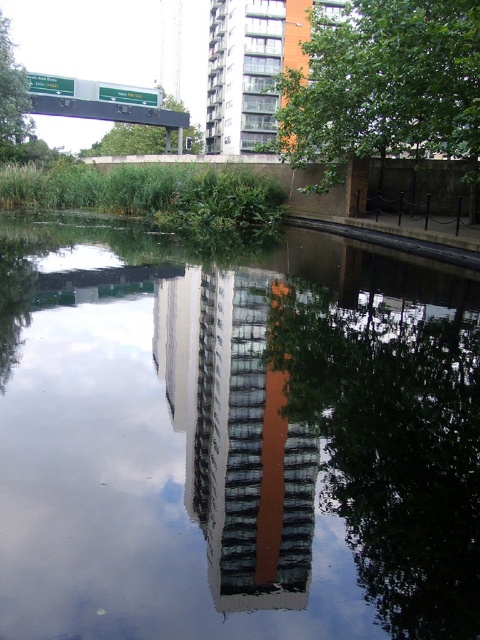
Question: Which is nearer to the green leafy tree at upper center?

Choices:
 (A) green leafy tree at upper left
 (B) reflective glass building at center

Answer: (A)

Question: Where is transparent glass water at center located in relation to green leafy tree at upper center in the image?

Choices:
 (A) below
 (B) above

Answer: (A)

Question: Is transparent glass water at center smaller than green leafy tree at center?

Choices:
 (A) yes
 (B) no

Answer: (A)

Question: Is transparent glass water at center above green leafy tree at upper center?

Choices:
 (A) yes
 (B) no

Answer: (B)

Question: Among these points, which one is nearest to the camera?

Choices:
 (A) (271, 435)
 (B) (355, 344)

Answer: (A)

Question: Among these objects, which one is farthest from the camera?

Choices:
 (A) green leafy tree at upper left
 (B) green leafy tree at upper center
 (C) reflective glass building at center
 (D) green leafy tree at center

Answer: (B)